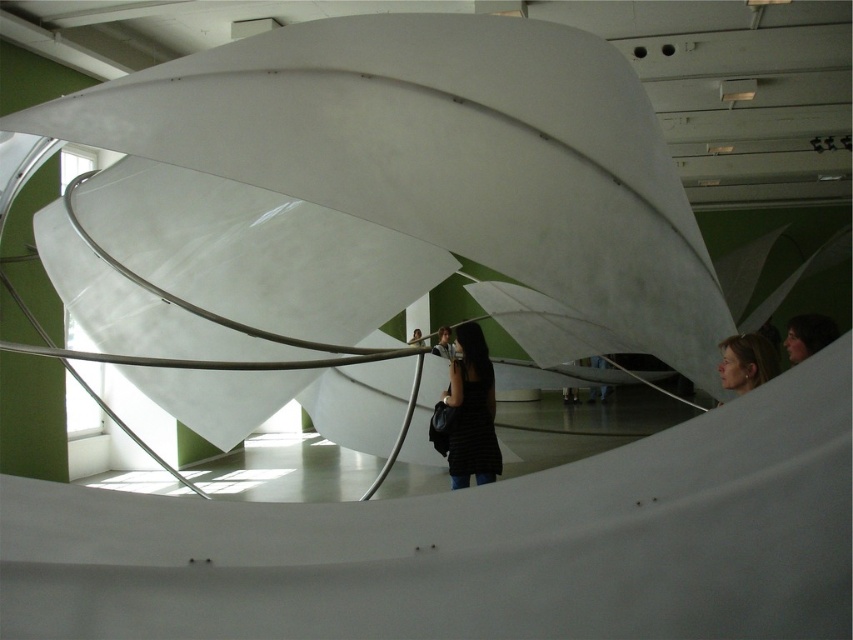
Which is behind, point (456, 340) or point (767, 378)?

The point (456, 340) is behind.

Which is behind, point (461, 353) or point (763, 340)?

The point (461, 353) is more distant.

Identify the location of black matte dress at center. (471, 410).